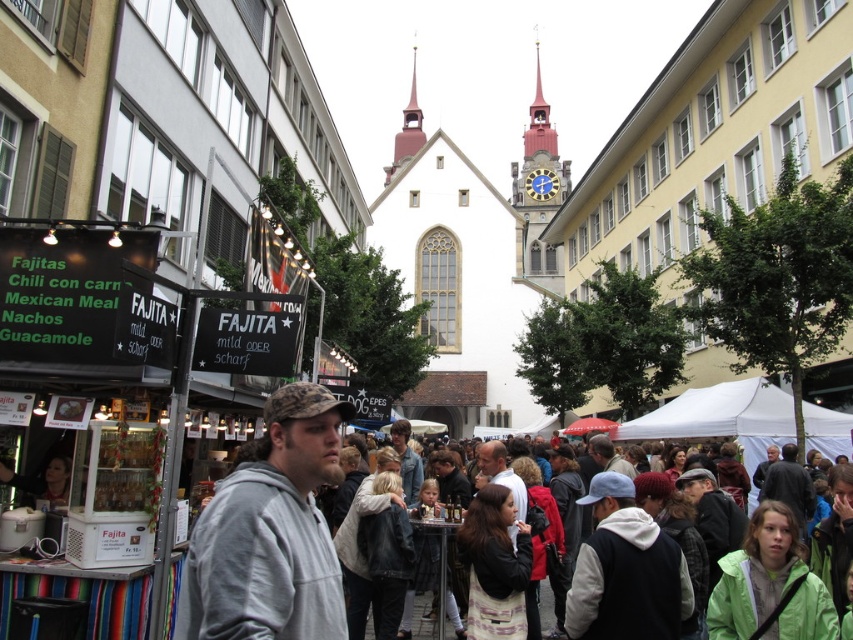
You are standing at the point closer to you in the market scene. Which point are you at, point (527, 285) or point (293, 493)?

You are at point (527, 285) because it is further to the viewer than point (293, 493).